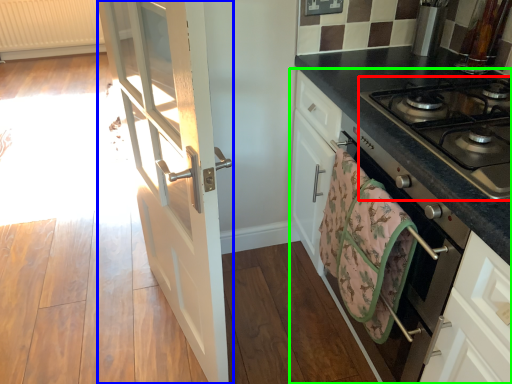
Question: Based on their relative distances, which object is farther from gas stove (highlighted by a red box)? Choose from door (highlighted by a blue box) and cabinetry (highlighted by a green box).

Choices:
 (A) door
 (B) cabinetry

Answer: (A)